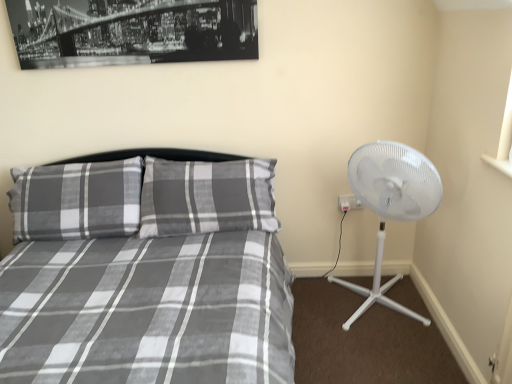
Describe the element at coordinates (349, 202) in the screenshot. I see `white plastic electric outlet at right` at that location.

Where is `plaid fabric pillow at left`? plaid fabric pillow at left is located at coordinates (77, 201).

Locate an element on the screen. This screenshot has width=512, height=384. white plastic fan at right is located at coordinates (391, 205).

Image resolution: width=512 pixels, height=384 pixels. In order to click on white plastic electric outlet at right in this screenshot , I will do `click(349, 202)`.

This screenshot has width=512, height=384. I want to click on pillow lying on the left of white plastic electric outlet at right, so click(x=77, y=201).

Is plaid fabric pillow at left far from white plastic electric outlet at right?

Indeed, plaid fabric pillow at left is not near white plastic electric outlet at right.

Considering the sizes of objects plaid fabric pillow at left and white plastic electric outlet at right in the image provided, who is shorter, plaid fabric pillow at left or white plastic electric outlet at right?

Standing shorter between the two is white plastic electric outlet at right.

From the picture: Which object is positioned more to the right, white plastic electric outlet at right or black matte print at upper center?

white plastic electric outlet at right is more to the right.

Considering the sizes of objects white plastic electric outlet at right and black matte print at upper center in the image provided, who is smaller, white plastic electric outlet at right or black matte print at upper center?

white plastic electric outlet at right is smaller.

How many degrees apart are the facing directions of white plastic electric outlet at right and black matte print at upper center?

They differ by 2.55 degrees in their facing directions.

Is white plastic electric outlet at right not within black matte print at upper center?

Yes, white plastic electric outlet at right is not within black matte print at upper center.

Considering the sizes of black matte print at upper center and gray plaid bed at center in the image, is black matte print at upper center bigger or smaller than gray plaid bed at center?

Considering their sizes, black matte print at upper center takes up less space than gray plaid bed at center.

Between black matte print at upper center and gray plaid bed at center, which one has more height?

gray plaid bed at center is taller.

Is white plastic fan at right placed right next to plaid fabric pillow at left?

No, white plastic fan at right is not in contact with plaid fabric pillow at left.

Between white plastic fan at right and plaid fabric pillow at left, which one appears on the left side from the viewer's perspective?

plaid fabric pillow at left is more to the left.

In the scene shown: How different are the orientations of white plastic fan at right and plaid fabric pillow at left in degrees?

2.19 degrees.

Locate an element on the screen. The width and height of the screenshot is (512, 384). mechanical fan that is in front of the plaid fabric pillow at left is located at coordinates (391, 205).

Does gray plaid bed at center lie in front of white plastic fan at right?

Yes, it is.

From the image's perspective, is gray plaid bed at center below white plastic fan at right?

Indeed, from the image's perspective, gray plaid bed at center is shown beneath white plastic fan at right.

In the scene shown: Is the surface of gray plaid bed at center in direct contact with white plastic fan at right?

gray plaid bed at center and white plastic fan at right are clearly separated.

Consider the image. Which is correct: gray plaid bed at center is inside white plastic fan at right, or outside of it?

gray plaid bed at center is spatially situated outside white plastic fan at right.

How much distance is there between black matte print at upper center and white plastic fan at right?

The distance of black matte print at upper center from white plastic fan at right is 1.13 meters.

Who is shorter, black matte print at upper center or white plastic fan at right?

Standing shorter between the two is black matte print at upper center.

Considering the sizes of black matte print at upper center and white plastic fan at right in the image, is black matte print at upper center wider or thinner than white plastic fan at right?

black matte print at upper center is thinner than white plastic fan at right.

Considering the relative sizes of black matte print at upper center and white plastic fan at right in the image provided, is black matte print at upper center smaller than white plastic fan at right?

Yes.

Is white plastic electric outlet at right located within white plastic fan at right?

That's incorrect, white plastic electric outlet at right is not inside white plastic fan at right.

Considering the positions of objects white plastic fan at right and white plastic electric outlet at right in the image provided, who is behind, white plastic fan at right or white plastic electric outlet at right?

white plastic electric outlet at right is further away from the camera.

Between white plastic fan at right and white plastic electric outlet at right, which one has smaller width?

Thinner between the two is white plastic electric outlet at right.

Consider the image. Is white plastic fan at right bigger than white plastic electric outlet at right?

Correct, white plastic fan at right is larger in size than white plastic electric outlet at right.

This screenshot has height=384, width=512. What are the coordinates of `pillow that is above the white plastic electric outlet at right (from the image's perspective)` in the screenshot? It's located at (77, 201).

Identify the location of electric outlet below the black matte print at upper center (from the image's perspective). (349, 202).

Which object lies nearer to the anchor point white plastic fan at right, black matte print at upper center or gray plaid bed at center?

Based on the image, gray plaid bed at center appears to be nearer to white plastic fan at right.

From the image, which object appears to be farther from white plastic fan at right, black matte print at upper center or plaid fabric pillow at left?

The object further to white plastic fan at right is plaid fabric pillow at left.

From the image, which object appears to be nearer to white plastic electric outlet at right, plaid fabric pillow at left or gray plaid bed at center?

gray plaid bed at center is closer to white plastic electric outlet at right.

Estimate the real-world distances between objects in this image. Which object is closer to white plastic fan at right, gray plaid bed at center or plaid fabric pillow at left?

gray plaid bed at center is closer to white plastic fan at right.

In the scene shown: Estimate the real-world distances between objects in this image. Which object is closer to gray plaid bed at center, plaid fabric pillow at left or white plastic fan at right?

plaid fabric pillow at left is closer to gray plaid bed at center.

Which object lies further to the anchor point gray plaid bed at center, white plastic fan at right or white plastic electric outlet at right?

Based on the image, white plastic electric outlet at right appears to be further to gray plaid bed at center.

From the image, which object appears to be nearer to gray plaid bed at center, plaid fabric pillow at left or black matte print at upper center?

plaid fabric pillow at left lies closer to gray plaid bed at center than the other object.

Estimate the real-world distances between objects in this image. Which object is further from white plastic fan at right, white plastic electric outlet at right or gray plaid bed at center?

The object further to white plastic fan at right is gray plaid bed at center.

Image resolution: width=512 pixels, height=384 pixels. In order to click on picture frame between plaid fabric pillow at left and white plastic electric outlet at right in this screenshot , I will do `click(131, 31)`.

At what (x,y) coordinates should I click in order to perform the action: click on picture frame situated between plaid fabric pillow at left and white plastic fan at right from left to right. Please return your answer as a coordinate pair (x, y). Image resolution: width=512 pixels, height=384 pixels. Looking at the image, I should click on (131, 31).

You are a GUI agent. You are given a task and a screenshot of the screen. Output one action in this format:
    pyautogui.click(x=<x>, y=<y>)
    Task: Click on the bed situated between black matte print at upper center and white plastic fan at right from left to right
    The width and height of the screenshot is (512, 384).
    Given the screenshot: What is the action you would take?
    pyautogui.click(x=144, y=277)

Locate an element on the screen. The image size is (512, 384). electric outlet between black matte print at upper center and white plastic fan at right is located at coordinates (349, 202).